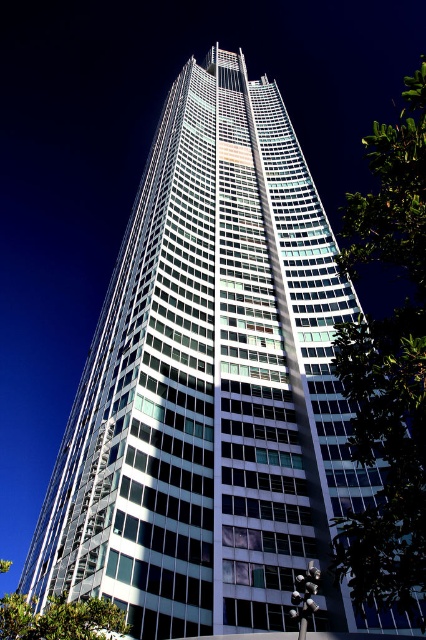
Question: Among these points, which one is farthest from the camera?

Choices:
 (A) (362, 340)
 (B) (83, 604)

Answer: (B)

Question: Is green leafy tree at right positioned before green leafy tree at lower left?

Choices:
 (A) yes
 (B) no

Answer: (A)

Question: Is green leafy tree at right below green leafy tree at lower left?

Choices:
 (A) yes
 (B) no

Answer: (B)

Question: Is green leafy tree at right above green leafy tree at lower left?

Choices:
 (A) no
 (B) yes

Answer: (B)

Question: Which of the following is the farthest from the observer?

Choices:
 (A) green leafy tree at lower left
 (B) green leafy tree at right

Answer: (A)